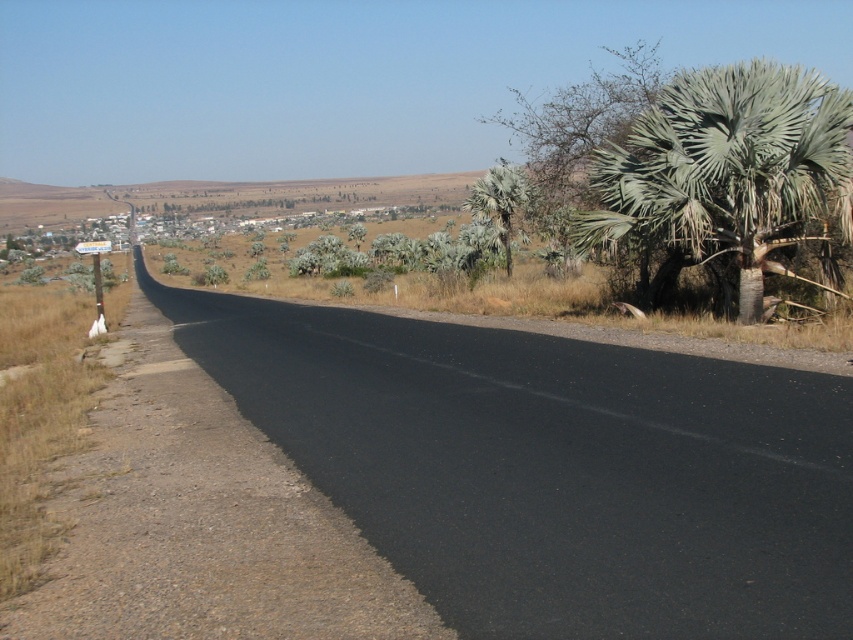
This screenshot has width=853, height=640. What do you see at coordinates (726, 168) in the screenshot?
I see `green leafy palm tree at right` at bounding box center [726, 168].

Is point (605, 202) less distant than point (498, 221)?

Yes, it is.

Which is in front, point (662, 112) or point (474, 193)?

Positioned in front is point (662, 112).

Locate an element on the screen. This screenshot has height=640, width=853. green leafy palm tree at right is located at coordinates (726, 168).